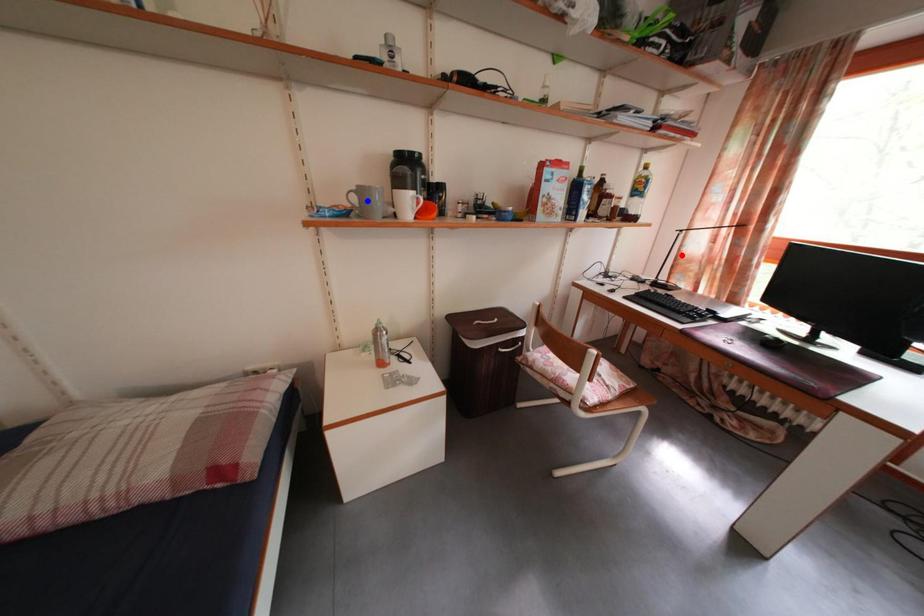
Question: Which of the two points in the image is closer to the camera?

Choices:
 (A) Blue point is closer.
 (B) Red point is closer.

Answer: (A)